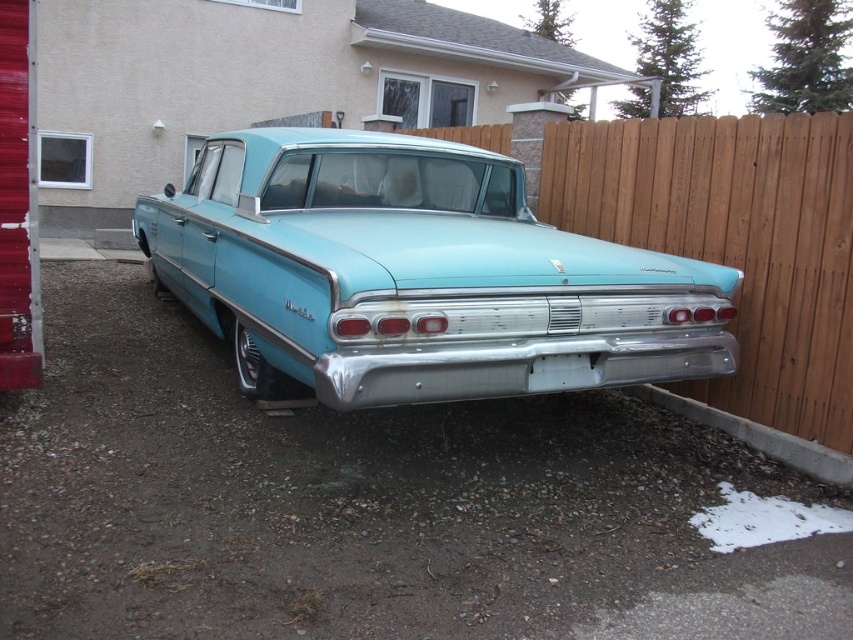
You are a delivery person carrying a package that requires a flat surface to place. You see the smooth asphalt driveway at center and the light blue metallic car at center. Which surface should you choose to place your package?

The smooth asphalt driveway at center is the appropriate surface to place the package since it is flat, while the light blue metallic car at center is not a flat surface for placing items.

You are a delivery person trying to park your van behind the light blue metallic car at center. The wooden fence at right is blocking the driveway. Can you fit your van behind the car without hitting the fence?

The light blue metallic car at center is above the wooden fence at right, meaning the fence is positioned lower in the driveway. Since the car is parked above the fence, there should be enough space behind the car to park the van without hitting the fence.